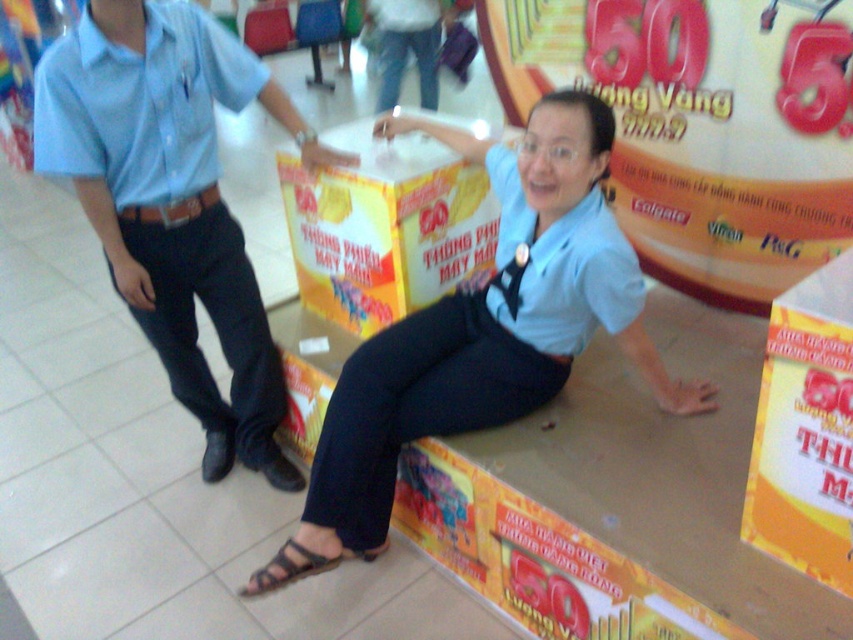
Is light blue cotton shirt at left to the right of light blue fabric shirt at center from the viewer's perspective?

Incorrect, light blue cotton shirt at left is not on the right side of light blue fabric shirt at center.

Based on the photo, who is more forward, (184,19) or (506,170)?

Positioned in front is point (506,170).

At what (x,y) coordinates should I click in order to perform the action: click on light blue cotton shirt at left. Please return your answer as a coordinate pair (x, y). The height and width of the screenshot is (640, 853). Looking at the image, I should click on (141, 104).

Can you confirm if light blue shirt at center is thinner than yellow cardboard box at center?

No.

The width and height of the screenshot is (853, 640). What do you see at coordinates (489, 321) in the screenshot? I see `light blue shirt at center` at bounding box center [489, 321].

Is point (573, 285) positioned after point (334, 257)?

No, it is not.

The height and width of the screenshot is (640, 853). Identify the location of light blue shirt at center. (489, 321).

Is light blue shirt at left bigger than light blue fabric shirt at center?

Correct, light blue shirt at left is larger in size than light blue fabric shirt at center.

Who is lower down, light blue shirt at left or light blue fabric shirt at center?

light blue shirt at left is below.

Between point (140, 20) and point (628, 314), which one is positioned in front?

Point (628, 314)

The height and width of the screenshot is (640, 853). I want to click on light blue shirt at left, so click(173, 200).